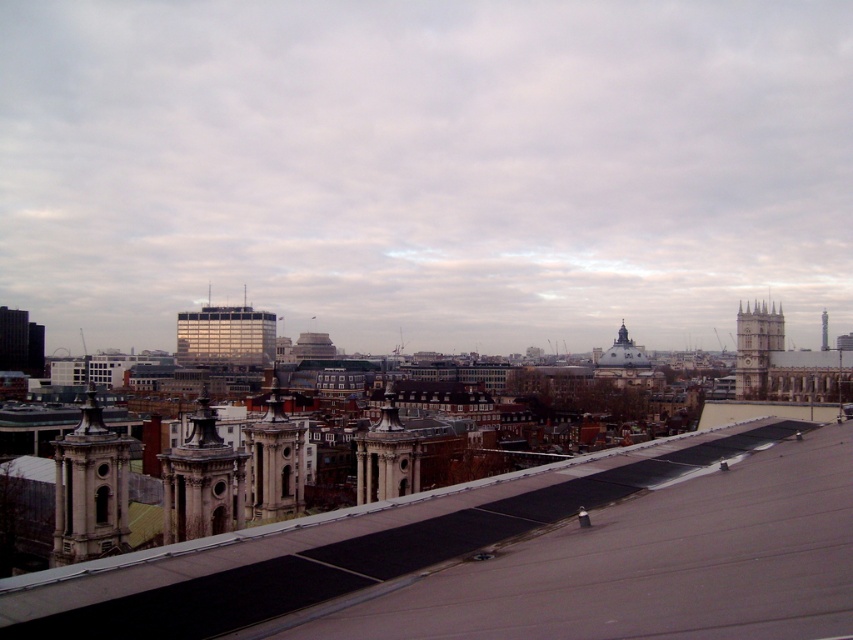
Question: Which object appears closest to the camera in this image?

Choices:
 (A) stone clock tower at right
 (B) smooth stone tower at center
 (C) stone tower at left

Answer: (C)

Question: In this image, where is stone clock tower at right located relative to smooth gray tower at upper right?

Choices:
 (A) left
 (B) right

Answer: (A)

Question: Which of these objects is positioned farthest from the stone tower at center?

Choices:
 (A) smooth gray tower at upper right
 (B) stone tower at left
 (C) stone clock tower at right

Answer: (A)

Question: Estimate the real-world distances between objects in this image. Which object is farther from the stone clock tower at right?

Choices:
 (A) smooth stone tower at center
 (B) stone tower at center-left
 (C) stone tower at left
 (D) smooth gray tower at upper right

Answer: (C)

Question: Does gray/flat roof at center have a lesser width compared to smooth gray tower at upper right?

Choices:
 (A) no
 (B) yes

Answer: (A)

Question: Is stone tower at center positioned before stone clock tower at right?

Choices:
 (A) yes
 (B) no

Answer: (A)